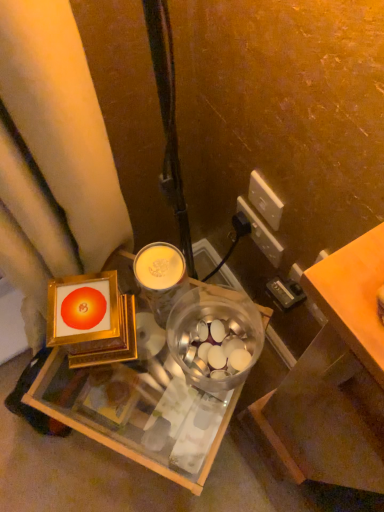
The image size is (384, 512). I want to click on orange matte table at right, so click(353, 296).

In order to face white plastic power outlet at upper right, the second power outlet in the back-to-front sequence, should I rotate leftwards or rightwards?

Turn right by 9.354 degrees to look at white plastic power outlet at upper right, the second power outlet in the back-to-front sequence.

Identify the location of white plastic power outlet at upper right, the first power outlet positioned from the back. The height and width of the screenshot is (512, 384). (262, 234).

The height and width of the screenshot is (512, 384). What do you see at coordinates (262, 234) in the screenshot?
I see `white plastic power outlet at upper right, acting as the 2th power outlet starting from the front` at bounding box center [262, 234].

Measure the distance between point (175, 263) and camera.

Point (175, 263) is 25.87 inches from camera.

Locate an element on the screen. The width and height of the screenshot is (384, 512). orange matte table at right is located at coordinates [353, 296].

From a real-world perspective, is white plastic power outlet at upper right, which is the 1th power outlet in front-to-back order, located higher than orange matte table at right?

No.

In the image, is white plastic power outlet at upper right, which is the 1th power outlet in front-to-back order, on the left side or the right side of orange matte table at right?

Clearly, white plastic power outlet at upper right, which is the 1th power outlet in front-to-back order, is on the right of orange matte table at right in the image.

Between white plastic power outlet at upper right, which is the 1th power outlet in front-to-back order, and orange matte table at right, which one has less height?

With less height is orange matte table at right.

Which is behind, point (250, 178) or point (357, 324)?

The point (250, 178) is behind.

Considering the relative sizes of transparent plastic bowl at center and white plastic power outlet at upper right, the first power outlet positioned from the back, in the image provided, is transparent plastic bowl at center wider than white plastic power outlet at upper right, the first power outlet positioned from the back,?

Yes.

Based on the photo, is transparent plastic bowl at center looking in the opposite direction of white plastic power outlet at upper right, the first power outlet positioned from the back?

Yes.

The height and width of the screenshot is (512, 384). In the image, there is a white plastic power outlet at upper right, the first power outlet positioned from the back. Find the location of `glass bowl below it (from the image's perspective)`. glass bowl below it (from the image's perspective) is located at coordinates pos(215,337).

Which object is closer to the camera, transparent plastic bowl at center or white plastic power outlet at upper right, the first power outlet positioned from the back?

transparent plastic bowl at center is closer to the camera.

From the image's perspective, would you say metallic gold frame at center is positioned over transparent plastic bowl at center?

Actually, metallic gold frame at center appears below transparent plastic bowl at center in the image.

Is metallic gold frame at center inside or outside of transparent plastic bowl at center?

metallic gold frame at center exists outside the volume of transparent plastic bowl at center.

Is metallic gold frame at center smaller than transparent plastic bowl at center?

No, metallic gold frame at center is not smaller than transparent plastic bowl at center.

Consider the image. Is metallic gold frame at center turned away from white plastic power outlet at upper right, the second power outlet in the back-to-front sequence?

No, metallic gold frame at center's orientation is not away from white plastic power outlet at upper right, the second power outlet in the back-to-front sequence.

Which object is closer to the camera taking this photo, metallic gold frame at center or white plastic power outlet at upper right, which is the 1th power outlet in front-to-back order?

white plastic power outlet at upper right, which is the 1th power outlet in front-to-back order, is in front.

Is metallic gold frame at center outside of white plastic power outlet at upper right, the second power outlet in the back-to-front sequence?

Yes, metallic gold frame at center is outside of white plastic power outlet at upper right, the second power outlet in the back-to-front sequence.

In the image, is orange matte table at right positioned in front of or behind white plastic power outlet at upper right, the second power outlet in the back-to-front sequence?

In the image, orange matte table at right appears in front of white plastic power outlet at upper right, the second power outlet in the back-to-front sequence.

Looking at this image, is orange matte table at right shorter than white plastic power outlet at upper right, the second power outlet in the back-to-front sequence?

Yes, orange matte table at right is shorter than white plastic power outlet at upper right, the second power outlet in the back-to-front sequence.

From the image's perspective, relative to white plastic power outlet at upper right, the second power outlet in the back-to-front sequence, is orange matte table at right above or below?

Clearly, from the image's perspective, orange matte table at right is below white plastic power outlet at upper right, the second power outlet in the back-to-front sequence.

Does orange matte table at right have a lesser width compared to white plastic power outlet at upper right, the second power outlet in the back-to-front sequence?

No.

Would you say orange matte table at right is a long distance from transparent plastic bowl at center?

No, orange matte table at right is not far away from transparent plastic bowl at center.

Locate an element on the screen. This screenshot has height=512, width=384. glass bowl behind the orange matte table at right is located at coordinates (215, 337).

Which object is closer to the camera, orange matte table at right or transparent plastic bowl at center?

orange matte table at right is in front.

Can you confirm if gold textured cup at center is taller than transparent plastic bowl at center?

Correct, gold textured cup at center is much taller as transparent plastic bowl at center.

Which is more to the left, gold textured cup at center or transparent plastic bowl at center?

Positioned to the left is gold textured cup at center.

Considering the sizes of gold textured cup at center and transparent plastic bowl at center in the image, is gold textured cup at center wider or thinner than transparent plastic bowl at center?

Considering their sizes, gold textured cup at center looks slimmer than transparent plastic bowl at center.

Which is in front, point (165, 275) or point (238, 365)?

The point (165, 275) is in front.

From the image's perspective, which power outlet is the 2nd one above the orange matte table at right? Please provide its 2D coordinates.

[(265, 200)]

Which power outlet is the 2nd one when counting from the right side of the transparent plastic bowl at center? Please provide its 2D coordinates.

[(262, 234)]

Estimate the real-world distances between objects in this image. Which object is closer to metallic gold frame at center, white plastic power outlet at upper right, which is the 1th power outlet in front-to-back order, or gold textured cup at center?

gold textured cup at center is closer to metallic gold frame at center.

Which object lies nearer to the anchor point gold textured cup at center, transparent plastic bowl at center or white plastic power outlet at upper right, the first power outlet positioned from the back?

transparent plastic bowl at center is closer to gold textured cup at center.

In the scene shown: Estimate the real-world distances between objects in this image. Which object is further from metallic gold frame at center, white plastic power outlet at upper right, acting as the 2th power outlet starting from the front, or orange matte table at right?

orange matte table at right.

Considering their positions, is metallic gold frame at center positioned closer to white plastic power outlet at upper right, the first power outlet positioned from the back, than transparent plastic bowl at center?

Based on the image, transparent plastic bowl at center appears to be nearer to white plastic power outlet at upper right, the first power outlet positioned from the back.

When comparing their distances from orange matte table at right, does transparent plastic bowl at center or metallic gold frame at center seem further?

metallic gold frame at center lies further to orange matte table at right than the other object.

Looking at the image, which one is located further to gold textured cup at center, transparent plastic bowl at center or white plastic power outlet at upper right, which is the 1th power outlet in front-to-back order?

Based on the image, white plastic power outlet at upper right, which is the 1th power outlet in front-to-back order, appears to be further to gold textured cup at center.

When comparing their distances from transparent plastic bowl at center, does metallic gold frame at center or white plastic power outlet at upper right, which is the 1th power outlet in front-to-back order, seem closer?

Based on the image, metallic gold frame at center appears to be nearer to transparent plastic bowl at center.

Considering their positions, is transparent plastic bowl at center positioned closer to orange matte table at right than white plastic power outlet at upper right, the first power outlet positioned from the back?

transparent plastic bowl at center is positioned closer to the anchor orange matte table at right.

You are a GUI agent. You are given a task and a screenshot of the screen. Output one action in this format:
    pyautogui.click(x=<x>, y=<y>)
    Task: Click on the glass bowl that lies between white plastic power outlet at upper right, the second power outlet in the back-to-front sequence, and metallic gold frame at center from top to bottom
    This screenshot has height=512, width=384.
    Given the screenshot: What is the action you would take?
    point(215,337)

Where is `glass bowl between orange matte table at right and gold textured cup at center in the front-back direction`? This screenshot has width=384, height=512. glass bowl between orange matte table at right and gold textured cup at center in the front-back direction is located at coordinates (215, 337).

Find the location of a particular element. The image size is (384, 512). power outlet between orange matte table at right and metallic gold frame at center in the front-back direction is located at coordinates (265, 200).

The width and height of the screenshot is (384, 512). Identify the location of coffee cup between white plastic power outlet at upper right, which is the 1th power outlet in front-to-back order, and transparent plastic bowl at center, in the vertical direction. (161, 277).